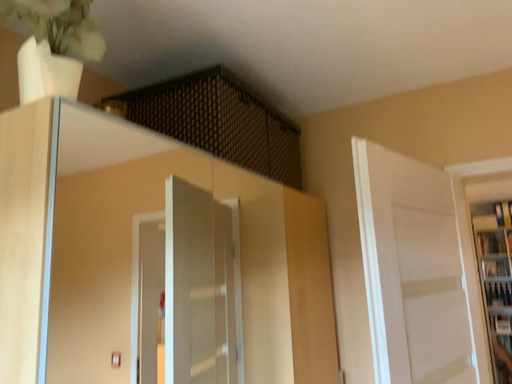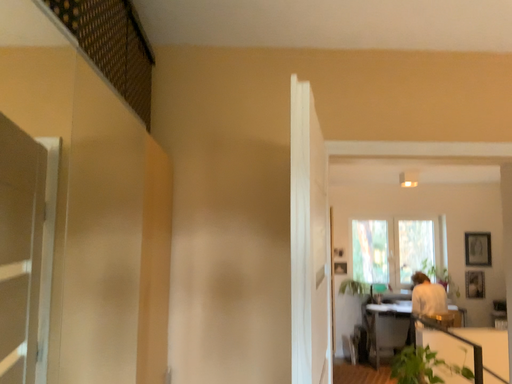
Question: How did the camera likely rotate when shooting the video?

Choices:
 (A) rotated right
 (B) rotated left

Answer: (A)